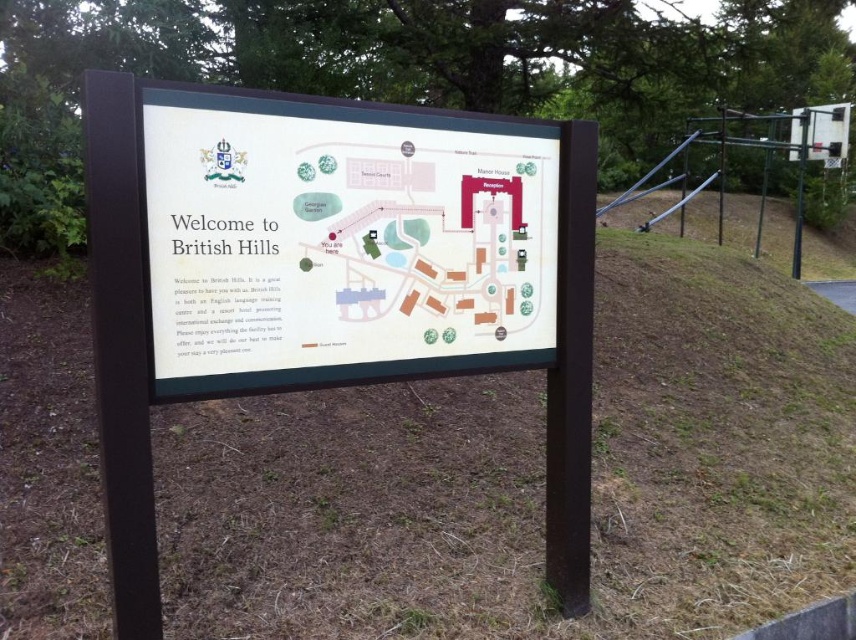
Question: Which object appears farthest from the camera in this image?

Choices:
 (A) white plastic sign at center
 (B) white plastic map at center

Answer: (B)

Question: Does white plastic map at center have a smaller size compared to white plastic sign at center?

Choices:
 (A) no
 (B) yes

Answer: (B)

Question: Which of the following is the farthest from the observer?

Choices:
 (A) (553, 198)
 (B) (409, 301)

Answer: (A)

Question: Can you confirm if white plastic map at center is positioned above white plastic sign at center?

Choices:
 (A) yes
 (B) no

Answer: (A)

Question: Where is white plastic map at center located in relation to white plastic sign at center in the image?

Choices:
 (A) right
 (B) left

Answer: (A)

Question: Which of the following is the closest to the observer?

Choices:
 (A) (239, 93)
 (B) (527, 205)

Answer: (A)